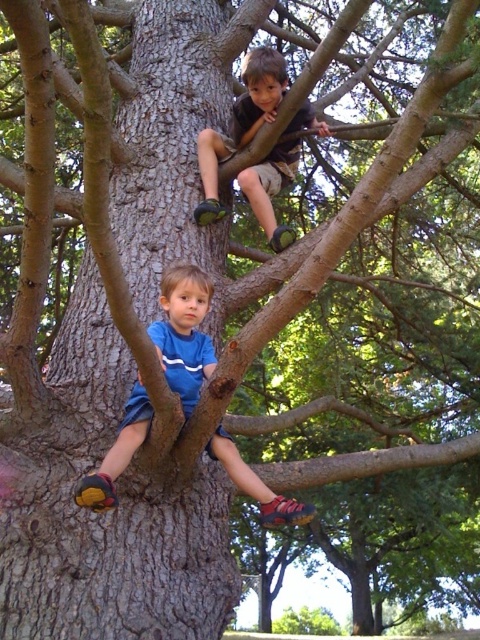
Does blue fabric shorts at lower left appear on the left side of matte brown shorts at upper center?

Yes, blue fabric shorts at lower left is to the left of matte brown shorts at upper center.

Between point (172, 349) and point (216, 166), which one is positioned in front?

Point (172, 349)

Where is `blue fabric shorts at lower left`? This screenshot has width=480, height=640. blue fabric shorts at lower left is located at coordinates (183, 332).